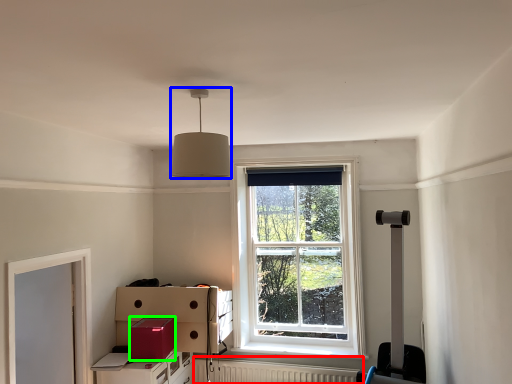
Question: Which is farther away from radiator (highlighted by a red box)? lamp (highlighted by a blue box) or cardboard box (highlighted by a green box)?

Choices:
 (A) lamp
 (B) cardboard box

Answer: (A)